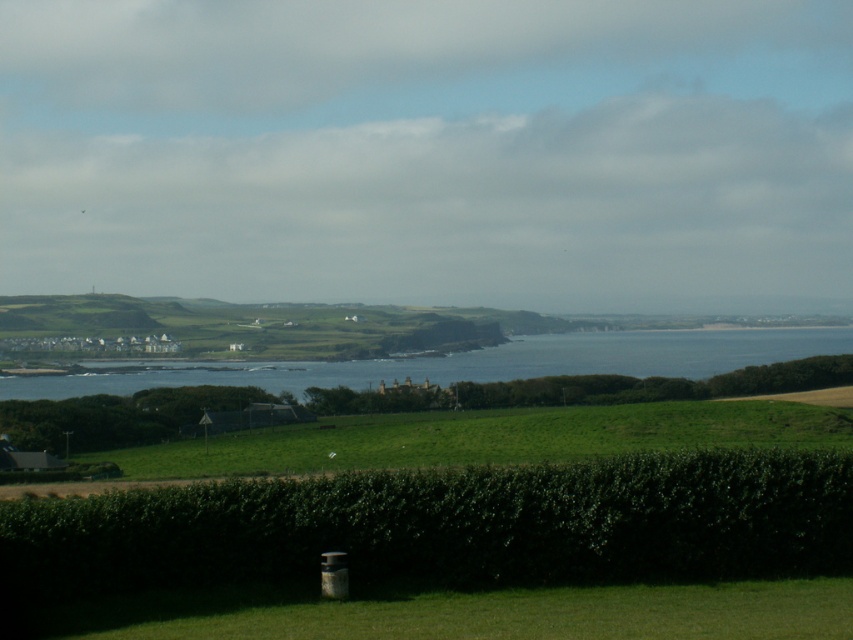
Between green leafy hedge at lower center and blue water at center, which one has more height?

With more height is blue water at center.

Does green leafy hedge at lower center have a lesser height compared to blue water at center?

Yes, green leafy hedge at lower center is shorter than blue water at center.

Identify the location of green leafy hedge at lower center. (450, 525).

Locate an element on the screen. This screenshot has width=853, height=640. green leafy hedge at lower center is located at coordinates (450, 525).